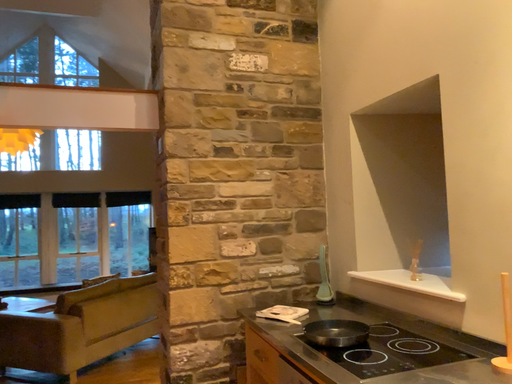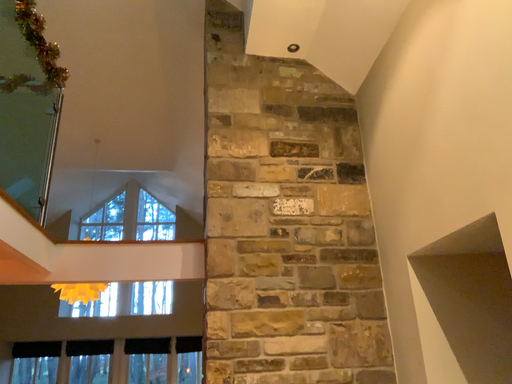
Question: Which way did the camera rotate in the video?

Choices:
 (A) rotated left
 (B) rotated right

Answer: (A)